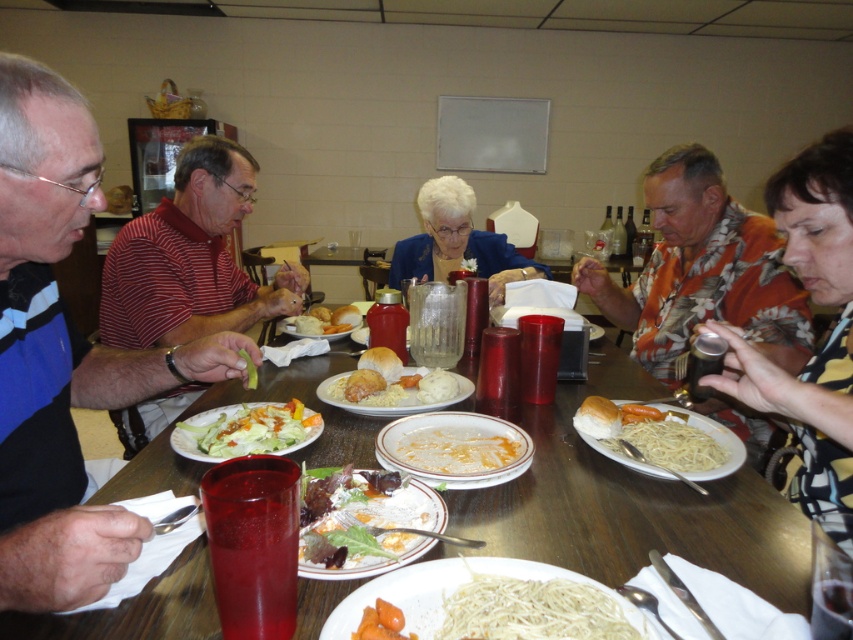
You are a food delivery person who needs to place a hot dish on the table. The blue fabric jacket at center and the white matte pasta at center are in the way. To avoid spilling the dish, you need to know which object is closer to the edge of the table. Which one is closer?

The blue fabric jacket at center is to the right of white matte pasta at center, but the description does not specify their distance from the table edge. Without additional information about their positions relative to the edge, I cannot determine which is closer.

You are a food critic who needs to describe the arrangement of the dishes on the table. Which dish is shorter in height between the fresh green salad at center and the white matte bread at center?

The fresh green salad at center is shorter in height compared to the white matte bread at center.

You are sitting at the long wooden table and want to reach for the white matte pasta at center without disturbing the blue fabric jacket at center. Is this possible?

The blue fabric jacket at center is further to the viewer than the white matte pasta at center, so you can reach the white matte pasta at center without moving the jacket.